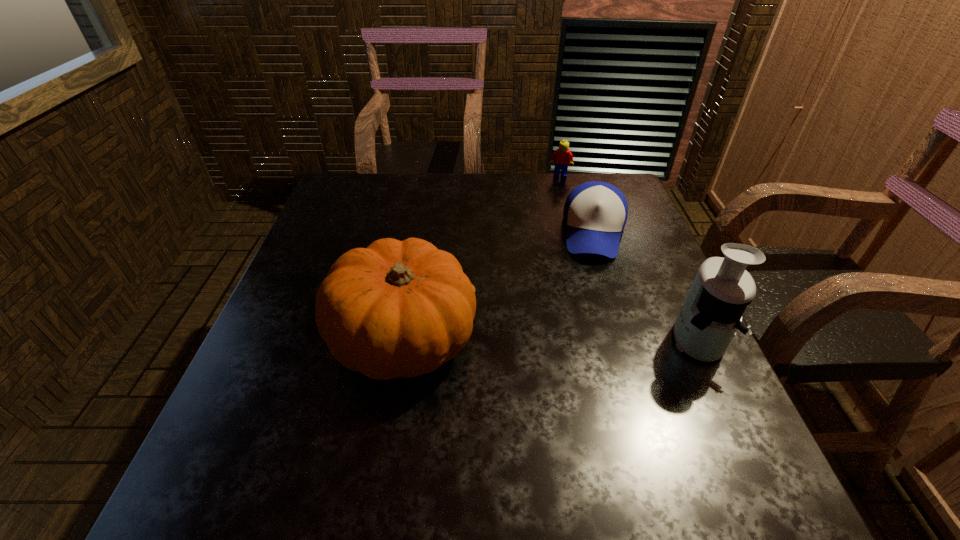
The image size is (960, 540). Find the location of `object that stands as the second closest to the tallest object`. object that stands as the second closest to the tallest object is located at coordinates (395, 309).

Identify which object is the second closest to the third nearest object. Please provide its 2D coordinates. Your answer should be formatted as a tuple, i.e. [(x, y)], where the tuple contains the x and y coordinates of a point satisfying the conditions above.

[(712, 312)]

Find the location of `vacant area that satisfies the following two spatial constraints: 1. on the back side of the Lego; 2. on the right side of the leftmost object`. vacant area that satisfies the following two spatial constraints: 1. on the back side of the Lego; 2. on the right side of the leftmost object is located at coordinates (431, 176).

In order to click on blank area in the image that satisfies the following two spatial constraints: 1. on the back side of the leftmost object; 2. on the left side of the tallest object in this screenshot , I will do `click(403, 339)`.